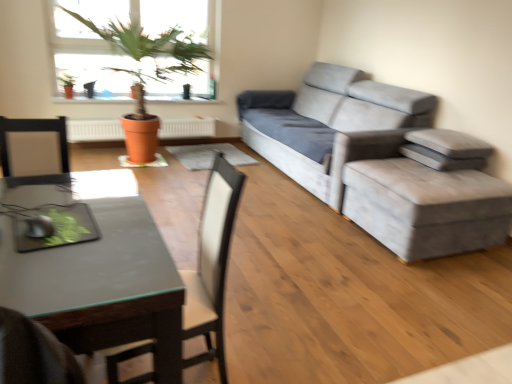
Where is `vacant space to the left of velvet grey stool at right`? This screenshot has width=512, height=384. vacant space to the left of velvet grey stool at right is located at coordinates (311, 231).